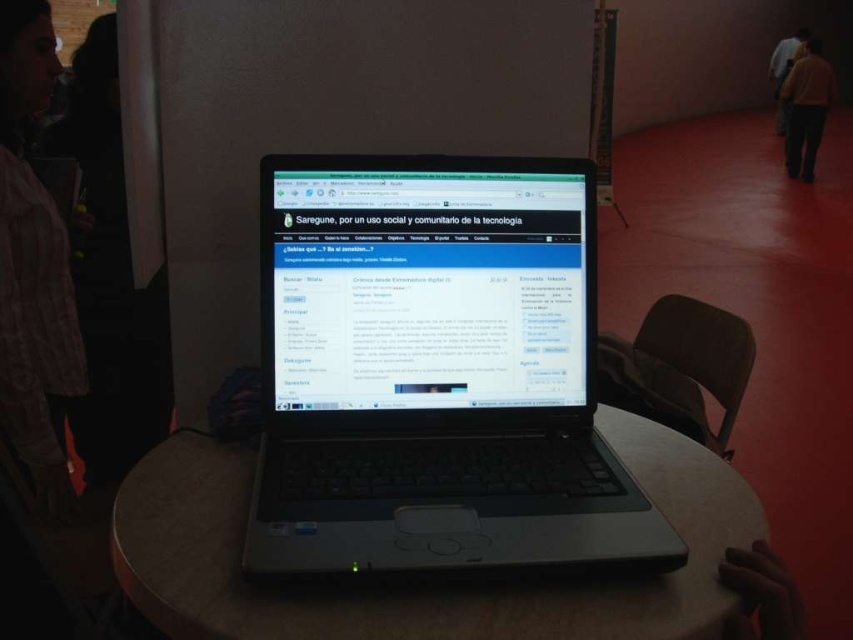
Question: Does black plastic laptop at center have a greater width compared to shiny black laptop at center?

Choices:
 (A) yes
 (B) no

Answer: (A)

Question: Does dark brown pants at upper right have a lesser width compared to light brown leather jacket at upper right?

Choices:
 (A) yes
 (B) no

Answer: (B)

Question: Does pink textured shirt at left have a smaller size compared to dark brown pants at upper right?

Choices:
 (A) yes
 (B) no

Answer: (A)

Question: Among these objects, which one is nearest to the camera?

Choices:
 (A) light brown leather jacket at upper right
 (B) black plastic laptop at center
 (C) dark brown pants at upper right
 (D) pink textured shirt at left

Answer: (B)

Question: Which of the following is the farthest from the observer?

Choices:
 (A) smooth wooden table at center
 (B) light brown leather jacket at upper right
 (C) shiny black laptop at center
 (D) dark brown pants at upper right

Answer: (B)

Question: Which of the following is the farthest from the observer?

Choices:
 (A) (776, 96)
 (B) (422, 188)
 (C) (566, 630)

Answer: (A)